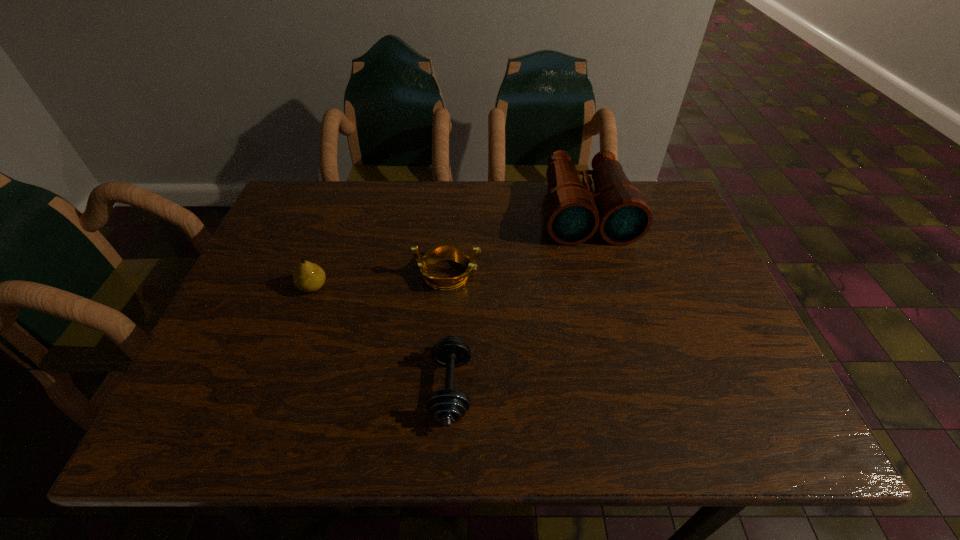
Locate an element on the screen. free spot at the far right corner of the desktop is located at coordinates (675, 198).

Where is `empty space between the tiara and the pear`? This screenshot has width=960, height=540. empty space between the tiara and the pear is located at coordinates (380, 281).

Locate an element on the screen. The width and height of the screenshot is (960, 540). empty space between the binoculars and the tiara is located at coordinates (516, 242).

Where is `free space between the tallest object and the tiara`? free space between the tallest object and the tiara is located at coordinates (516, 242).

Find the location of `blank region between the rightmost object and the tiara`. blank region between the rightmost object and the tiara is located at coordinates (516, 242).

Locate an element on the screen. This screenshot has width=960, height=540. blank region between the shortest object and the binoculars is located at coordinates (518, 300).

This screenshot has width=960, height=540. Identify the location of free space between the tiara and the pear. (380, 281).

The width and height of the screenshot is (960, 540). I want to click on vacant point located between the tiara and the leftmost object, so click(380, 281).

What are the coordinates of `vacant space that's between the nearest object and the tallest object` in the screenshot? It's located at (518, 300).

This screenshot has width=960, height=540. In order to click on the second closest object to the farthest object in this screenshot , I will do `click(448, 406)`.